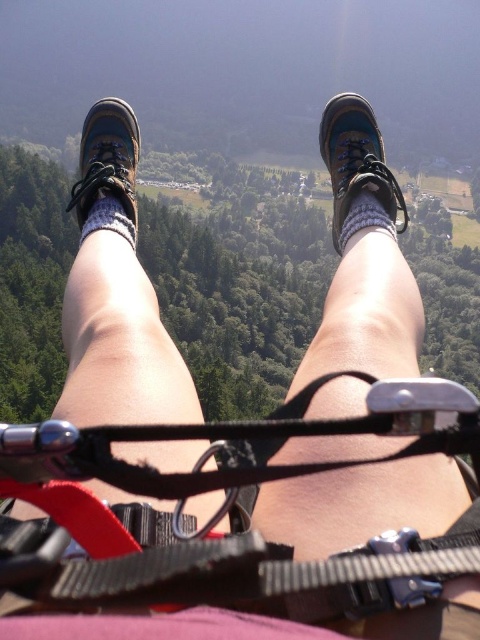
Question: Among these points, which one is nearest to the camera?

Choices:
 (A) (99, 148)
 (B) (381, 595)

Answer: (B)

Question: Which point is closer to the camera?

Choices:
 (A) brown leather boot at center
 (B) matte blue hiking shoe at center
 (C) suede sock at center
 (D) black nylon strap at center

Answer: (D)

Question: Does black nylon strap at center appear over matte black shoe at left?

Choices:
 (A) yes
 (B) no

Answer: (B)

Question: Which point appears closest to the camera in this image?

Choices:
 (A) (391, 205)
 (B) (36, 582)
 (C) (369, 189)
 (D) (127, 237)

Answer: (B)

Question: Does brown leather boot at center lie behind gray knitted sock at center?

Choices:
 (A) no
 (B) yes

Answer: (B)

Question: Does black nylon strap at center appear under gray knitted sock at center?

Choices:
 (A) no
 (B) yes

Answer: (B)